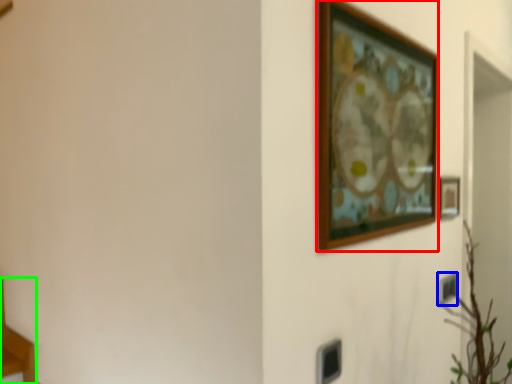
Question: Considering the real-world distances, which object is closest to picture frame (highlighted by a red box)? electric outlet (highlighted by a blue box) or furniture (highlighted by a green box).

Choices:
 (A) electric outlet
 (B) furniture

Answer: (A)